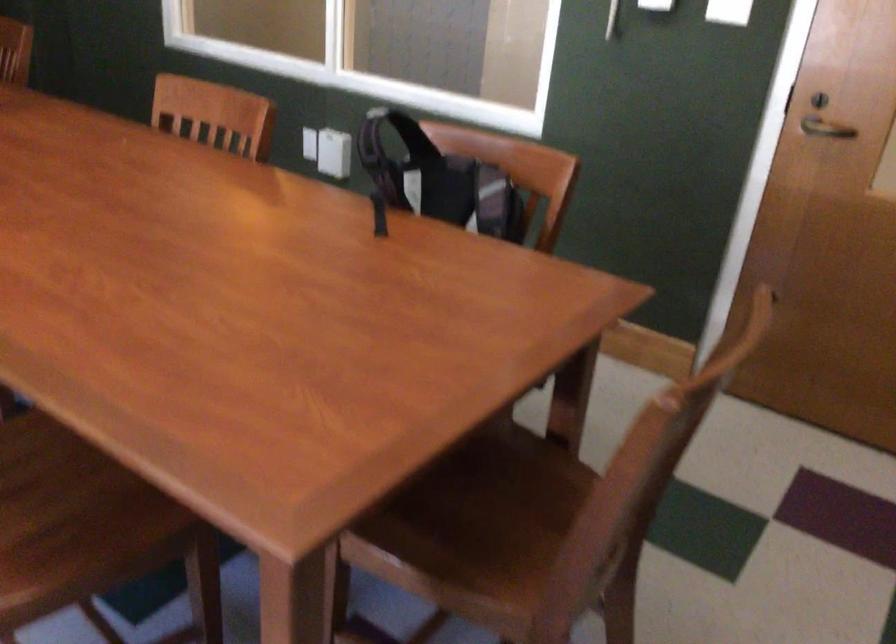
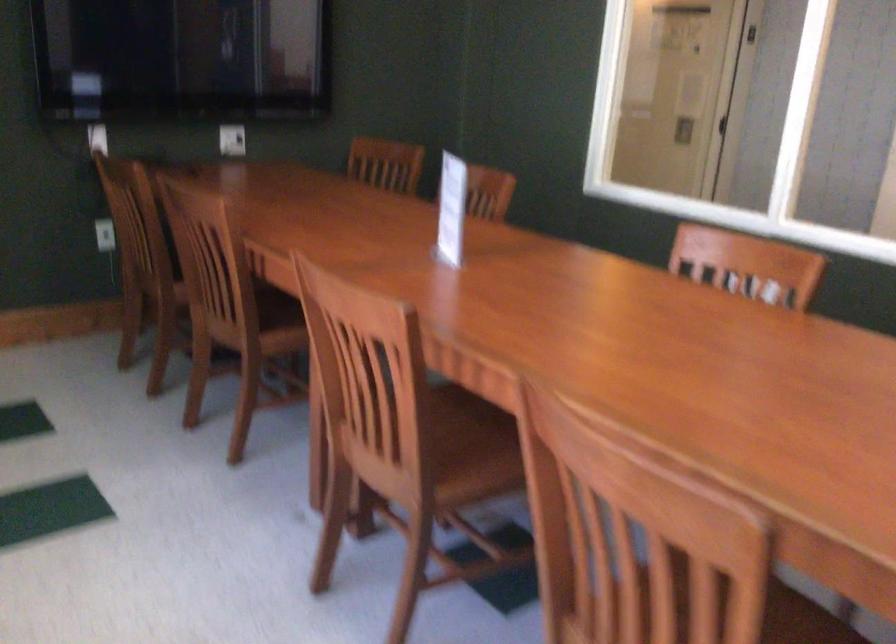
Question: Based on the continuous images, in which direction is the camera rotating? Reply with the corresponding letter.

Choices:
 (A) Left
 (B) Right
 (C) Up
 (D) Down

Answer: (A)